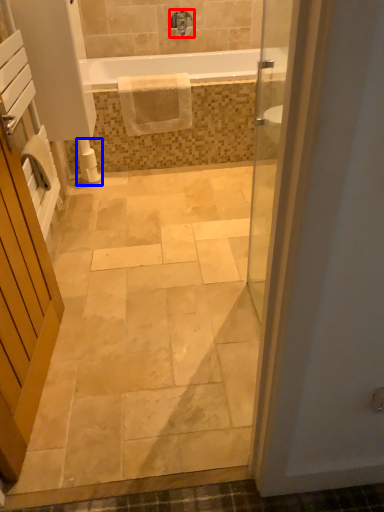
Question: Which object appears closest to the camera in this image, tap (highlighted by a red box) or toilet paper (highlighted by a blue box)?

Choices:
 (A) tap
 (B) toilet paper

Answer: (B)